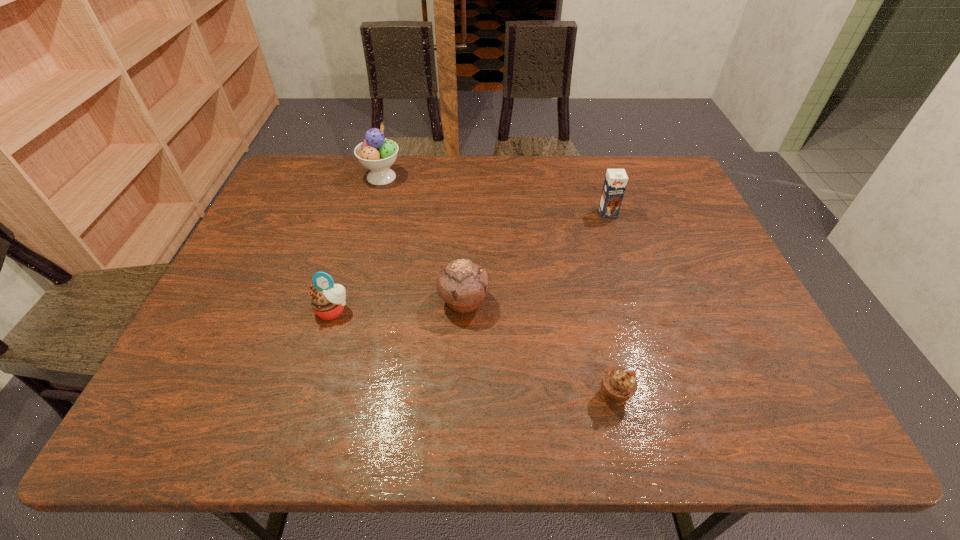
Identify which object is the fourth closest to the chocolate milk. Please provide its 2D coordinates. Your answer should be formatted as a tuple, i.e. [(x, y)], where the tuple contains the x and y coordinates of a point satisfying the conditions above.

[(328, 300)]

Select which muffin appears as the third closest to the icecream. Please provide its 2D coordinates. Your answer should be formatted as a tuple, i.e. [(x, y)], where the tuple contains the x and y coordinates of a point satisfying the conditions above.

[(618, 384)]

Select which muffin is the closest to the chocolate milk. Please provide its 2D coordinates. Your answer should be formatted as a tuple, i.e. [(x, y)], where the tuple contains the x and y coordinates of a point satisfying the conditions above.

[(462, 284)]

Image resolution: width=960 pixels, height=540 pixels. What are the coordinates of `vacant region that satisfies the following two spatial constraints: 1. on the front side of the fourth object from left to right; 2. on the left side of the icecream` in the screenshot? It's located at (322, 395).

Image resolution: width=960 pixels, height=540 pixels. I want to click on free region that satisfies the following two spatial constraints: 1. on the front side of the icecream; 2. on the left side of the rightmost muffin, so click(x=322, y=395).